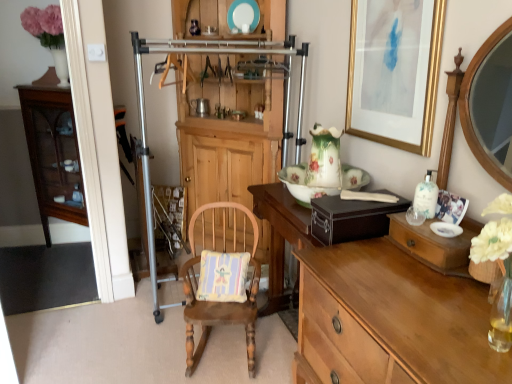
Locate an element on the screen. Image resolution: width=512 pixels, height=384 pixels. white glossy bottle at upper right is located at coordinates (426, 196).

You are a GUI agent. You are given a task and a screenshot of the screen. Output one action in this format:
    pyautogui.click(x=<x>, y=<y>)
    Task: Click on the floral porcelain plate at center, arranged as the 1th plate when viewed from the front
    The width and height of the screenshot is (512, 384).
    Given the screenshot: What is the action you would take?
    304,188

Identify the location of mahogany glass-front cabinet at left, which ranks as the first cabinetry in left-to-right order. point(53,151).

I want to click on pastel striped fabric pillow at center, so click(x=223, y=276).

What do you see at coordinates (243, 14) in the screenshot? The height and width of the screenshot is (384, 512). I see `teal glossy plate at upper center, the first plate positioned from the back` at bounding box center [243, 14].

This screenshot has width=512, height=384. What are the coordinates of `white glossy bottle at upper right` in the screenshot? It's located at (426, 196).

Considering the sizes of mahogany glass-front cabinet at left, which ranks as the first cabinetry in left-to-right order, and light brown wood desk at center in the image, is mahogany glass-front cabinet at left, which ranks as the first cabinetry in left-to-right order, wider or thinner than light brown wood desk at center?

mahogany glass-front cabinet at left, which ranks as the first cabinetry in left-to-right order, is thinner than light brown wood desk at center.

Does mahogany glass-front cabinet at left, which ranks as the first cabinetry in left-to-right order, appear on the right side of light brown wood desk at center?

Incorrect, mahogany glass-front cabinet at left, which ranks as the first cabinetry in left-to-right order, is not on the right side of light brown wood desk at center.

Considering the sizes of objects mahogany glass-front cabinet at left, which ranks as the first cabinetry in left-to-right order, and light brown wood desk at center in the image provided, who is shorter, mahogany glass-front cabinet at left, which ranks as the first cabinetry in left-to-right order, or light brown wood desk at center?

Standing shorter between the two is light brown wood desk at center.

Does pastel striped fabric pillow at center have a larger size compared to light brown wood desk at center?

No.

Are pastel striped fabric pillow at center and light brown wood desk at center making contact?

No, pastel striped fabric pillow at center is not making contact with light brown wood desk at center.

Is light brown wood desk at center surrounded by pastel striped fabric pillow at center?

No, light brown wood desk at center is not surrounded by pastel striped fabric pillow at center.

Is pastel striped fabric pillow at center aimed at light brown wood desk at center?

No, pastel striped fabric pillow at center is not aimed at light brown wood desk at center.

Can you tell me how much mahogany glass-front cabinet at left, which ranks as the first cabinetry in left-to-right order, and wooden rocking chair with cushion at center differ in facing direction?

The angle between the facing direction of mahogany glass-front cabinet at left, which ranks as the first cabinetry in left-to-right order, and the facing direction of wooden rocking chair with cushion at center is 12.2 degrees.

Can you confirm if mahogany glass-front cabinet at left, which ranks as the first cabinetry in left-to-right order, is thinner than wooden rocking chair with cushion at center?

No.

Image resolution: width=512 pixels, height=384 pixels. Find the location of `cabinetry that is the 1st object above the wooden rocking chair with cushion at center (from a real-world perspective)`. cabinetry that is the 1st object above the wooden rocking chair with cushion at center (from a real-world perspective) is located at coordinates (53, 151).

Is wooden cabinet at center, which is counted as the 2th cabinetry, starting from the left, far from pastel striped fabric pillow at center?

Yes, wooden cabinet at center, which is counted as the 2th cabinetry, starting from the left, and pastel striped fabric pillow at center are located far from each other.

Is wooden cabinet at center, which is the first cabinetry in right-to-left order, shorter than pastel striped fabric pillow at center?

Incorrect, the height of wooden cabinet at center, which is the first cabinetry in right-to-left order, does not fall short of that of pastel striped fabric pillow at center.

Can you tell me how much wooden cabinet at center, which is the first cabinetry in right-to-left order, and pastel striped fabric pillow at center differ in facing direction?

The facing directions of wooden cabinet at center, which is the first cabinetry in right-to-left order, and pastel striped fabric pillow at center are 29.7 degrees apart.

Based on the photo, from the image's perspective, does light brown wood desk at center appear lower than teal glossy plate at upper center, the second plate from the front?

Yes, from the image's perspective, light brown wood desk at center is beneath teal glossy plate at upper center, the second plate from the front.

Does light brown wood desk at center touch teal glossy plate at upper center, which ranks as the 2th plate in bottom-to-top order?

light brown wood desk at center and teal glossy plate at upper center, which ranks as the 2th plate in bottom-to-top order, are clearly separated.

Based on their positions, is light brown wood desk at center located to the left or right of teal glossy plate at upper center, positioned as the first plate in left-to-right order?

From the image, it's evident that light brown wood desk at center is to the right of teal glossy plate at upper center, positioned as the first plate in left-to-right order.

From a real-world perspective, which object stands above the other?

From a 3D spatial view, teal glossy plate at upper center, acting as the first plate starting from the top, is above.

Is floral porcelain plate at center, which ranks as the first plate in right-to-left order, at the back of light brown wood desk at center?

No.

Which of these two, light brown wood desk at center or floral porcelain plate at center, acting as the 2th plate starting from the top, is bigger?

light brown wood desk at center.

Would you consider light brown wood desk at center to be distant from floral porcelain plate at center, placed as the 2th plate when sorted from back to front?

They are positioned close to each other.

Considering the sizes of objects light brown wood desk at center and floral porcelain plate at center, placed as the 2th plate when sorted from back to front, in the image provided, who is thinner, light brown wood desk at center or floral porcelain plate at center, placed as the 2th plate when sorted from back to front,?

With smaller width is floral porcelain plate at center, placed as the 2th plate when sorted from back to front.

Considering the sizes of objects pastel striped fabric pillow at center and mahogany glass-front cabinet at left, which ranks as the first cabinetry in left-to-right order, in the image provided, who is bigger, pastel striped fabric pillow at center or mahogany glass-front cabinet at left, which ranks as the first cabinetry in left-to-right order,?

mahogany glass-front cabinet at left, which ranks as the first cabinetry in left-to-right order, is bigger.

Could you tell me if pastel striped fabric pillow at center is turned towards mahogany glass-front cabinet at left, which ranks as the first cabinetry in left-to-right order?

No, pastel striped fabric pillow at center is not facing towards mahogany glass-front cabinet at left, which ranks as the first cabinetry in left-to-right order.

Considering the relative sizes of pastel striped fabric pillow at center and mahogany glass-front cabinet at left, which ranks as the first cabinetry in left-to-right order, in the image provided, is pastel striped fabric pillow at center wider than mahogany glass-front cabinet at left, which ranks as the first cabinetry in left-to-right order,?

Incorrect, the width of pastel striped fabric pillow at center does not surpass that of mahogany glass-front cabinet at left, which ranks as the first cabinetry in left-to-right order.

Would you say pastel striped fabric pillow at center is to the left or to the right of mahogany glass-front cabinet at left, which ranks as the first cabinetry in left-to-right order, in the picture?

Based on their positions, pastel striped fabric pillow at center is located to the right of mahogany glass-front cabinet at left, which ranks as the first cabinetry in left-to-right order.

The width and height of the screenshot is (512, 384). In order to click on the 2nd cabinetry behind the light brown wood desk at center in this screenshot , I will do tap(53, 151).

At what (x,y) coordinates should I click in order to perform the action: click on desk in front of the pastel striped fabric pillow at center. Please return your answer as a coordinate pair (x, y). Looking at the image, I should click on (378, 309).

Considering their positions, is mahogany glass-front cabinet at left, the second cabinetry from the right, positioned further to floral porcelain plate at center, acting as the 2th plate starting from the top, than light brown wood desk at center?

mahogany glass-front cabinet at left, the second cabinetry from the right, lies further to floral porcelain plate at center, acting as the 2th plate starting from the top, than the other object.

Consider the image. Considering their positions, is wooden rocking chair with cushion at center positioned further to floral porcelain plate at center, placed as the first plate when sorted from bottom to top, than metallic silver coffee cup at center?

Among the two, metallic silver coffee cup at center is located further to floral porcelain plate at center, placed as the first plate when sorted from bottom to top.

Based on their spatial positions, is gold-framed artwork at upper right or white glossy bottle at upper right further from wooden dresser at center?

white glossy bottle at upper right is positioned further to the anchor wooden dresser at center.

Estimate the real-world distances between objects in this image. Which object is closer to pastel striped fabric pillow at center, floral porcelain plate at center, placed as the first plate when sorted from bottom to top, or wooden cabinet at center, which is the first cabinetry in right-to-left order?

floral porcelain plate at center, placed as the first plate when sorted from bottom to top, lies closer to pastel striped fabric pillow at center than the other object.

Looking at the image, which one is located closer to wooden cabinet at center, which is counted as the 2th cabinetry, starting from the left, wooden rocking chair with cushion at center or white glossy bottle at upper right?

wooden rocking chair with cushion at center is positioned closer to the anchor wooden cabinet at center, which is counted as the 2th cabinetry, starting from the left.

Based on their spatial positions, is wooden dresser at center or gold-framed artwork at upper right further from floral porcelain plate at center, placed as the 2th plate when sorted from back to front?

wooden dresser at center is positioned further to the anchor floral porcelain plate at center, placed as the 2th plate when sorted from back to front.

Considering their positions, is gold-framed artwork at upper right positioned closer to mahogany glass-front cabinet at left, the second cabinetry from the right, than wooden dresser at center?

wooden dresser at center is positioned closer to the anchor mahogany glass-front cabinet at left, the second cabinetry from the right.

From the image, which object appears to be nearer to wooden rocking chair with cushion at center, pastel striped fabric pillow at center or floral porcelain plate at center, the second plate in the left-to-right sequence?

pastel striped fabric pillow at center lies closer to wooden rocking chair with cushion at center than the other object.

Locate an element on the screen. The image size is (512, 384). coffee cup between teal glossy plate at upper center, placed as the second plate when sorted from right to left, and wooden cabinet at center, which is counted as the 2th cabinetry, starting from the left, in the vertical direction is located at coordinates (200, 107).

The width and height of the screenshot is (512, 384). Identify the location of picture frame between light brown wood desk at center and metallic silver coffee cup at center in the front-back direction. (395, 74).

I want to click on dresser between gold-framed artwork at upper right and metallic silver coffee cup at center in the front-back direction, so 200,53.

Locate an element on the screen. The width and height of the screenshot is (512, 384). dresser between mahogany glass-front cabinet at left, which ranks as the first cabinetry in left-to-right order, and gold-framed artwork at upper right, in the horizontal direction is located at coordinates (200, 53).